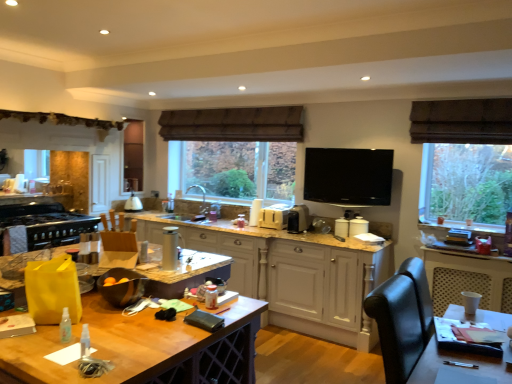
Question: Which direction should I rotate to face satin silver toaster at center, marked as the second appliance in a right-to-left arrangement, — up or down?

Choices:
 (A) down
 (B) up

Answer: (A)

Question: Which direction should I rotate to look at silver metallic thermos at center, the 6th appliance viewed from the back?

Choices:
 (A) right
 (B) left

Answer: (B)

Question: Does brown fabric exhaust hood at upper center have a larger size compared to satin silver toaster at center, the fifth appliance positioned from the left?

Choices:
 (A) yes
 (B) no

Answer: (A)

Question: Is brown fabric exhaust hood at upper center in front of satin silver toaster at center, which appears as the 3th appliance when viewed from the back?

Choices:
 (A) no
 (B) yes

Answer: (A)

Question: Is brown fabric exhaust hood at upper center shorter than satin silver toaster at center, the fourth appliance positioned from the front?

Choices:
 (A) yes
 (B) no

Answer: (B)

Question: Are brown fabric exhaust hood at upper center and satin silver toaster at center, the fifth appliance positioned from the left, making contact?

Choices:
 (A) yes
 (B) no

Answer: (B)

Question: Are brown fabric exhaust hood at upper center and satin silver toaster at center, the fourth appliance positioned from the front, far apart?

Choices:
 (A) yes
 (B) no

Answer: (A)

Question: Does brown fabric exhaust hood at upper center appear on the left side of satin silver toaster at center, which appears as the 3th appliance when viewed from the back?

Choices:
 (A) yes
 (B) no

Answer: (A)

Question: Does satin silver toaster at center, the fifth appliance positioned from the left, turn towards matte white lampshade at center, positioned as the 2th appliance in left-to-right order?

Choices:
 (A) yes
 (B) no

Answer: (B)

Question: From the image's perspective, is satin silver toaster at center, the fifth appliance positioned from the left, over matte white lampshade at center, positioned as the 2th appliance in left-to-right order?

Choices:
 (A) no
 (B) yes

Answer: (A)

Question: Can you confirm if satin silver toaster at center, marked as the second appliance in a right-to-left arrangement, is bigger than matte white lampshade at center, positioned as the 6th appliance in front-to-back order?

Choices:
 (A) yes
 (B) no

Answer: (A)

Question: From a real-world perspective, is satin silver toaster at center, the fourth appliance positioned from the front, physically below matte white lampshade at center, positioned as the first appliance in back-to-front order?

Choices:
 (A) yes
 (B) no

Answer: (B)

Question: From the image's perspective, is satin silver toaster at center, the fourth appliance positioned from the front, under matte white lampshade at center, positioned as the 6th appliance in front-to-back order?

Choices:
 (A) no
 (B) yes

Answer: (B)

Question: Does satin silver toaster at center, the fourth appliance positioned from the front, have a lesser width compared to matte white lampshade at center, positioned as the 6th appliance in front-to-back order?

Choices:
 (A) no
 (B) yes

Answer: (A)

Question: Is wooden table at center shorter than black matte stove at left, positioned as the sixth appliance in right-to-left order?

Choices:
 (A) no
 (B) yes

Answer: (A)